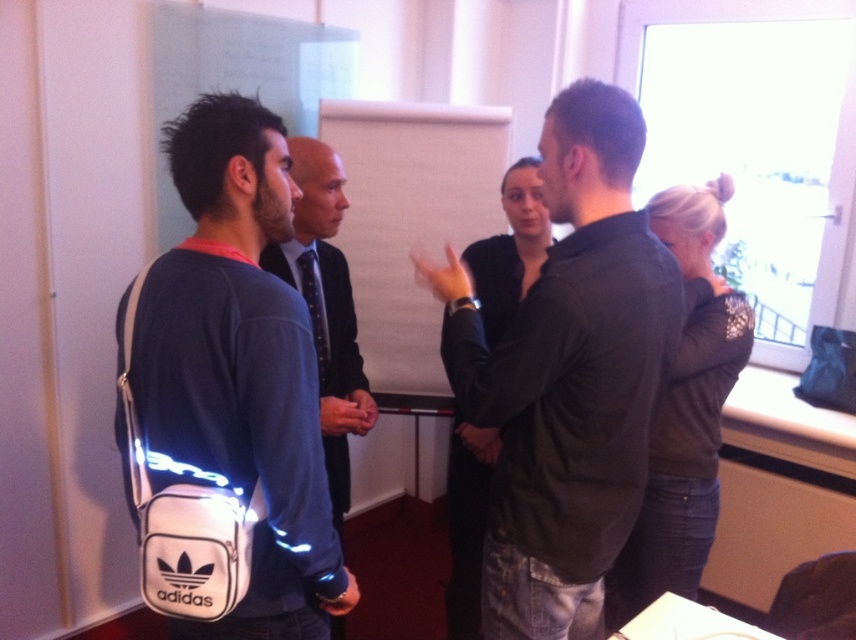
Question: Can you confirm if dark green shirt at center is bigger than blue denim shirt at center?

Choices:
 (A) no
 (B) yes

Answer: (B)

Question: Which point is closer to the camera taking this photo?

Choices:
 (A) (360, 424)
 (B) (230, 484)
 (C) (664, 282)

Answer: (B)

Question: Can you confirm if white synthetic adidas bag at left is wider than blue denim shirt at center?

Choices:
 (A) no
 (B) yes

Answer: (B)

Question: From the image, what is the correct spatial relationship of dark green shirt at center in relation to white synthetic adidas bag at left?

Choices:
 (A) below
 (B) above

Answer: (B)

Question: Which is farther from the dark green shirt at center?

Choices:
 (A) white synthetic adidas bag at left
 (B) blue denim shirt at center

Answer: (B)

Question: Which point is farther to the camera?

Choices:
 (A) dark green shirt at center
 (B) white synthetic adidas bag at left
 (C) blue denim shirt at center

Answer: (C)